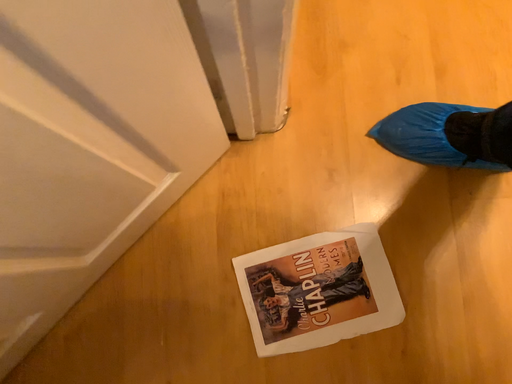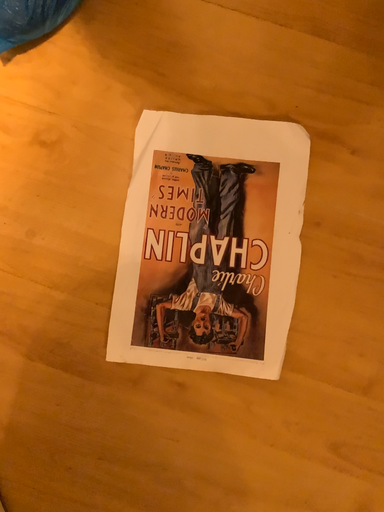
Question: Which way did the camera rotate in the video?

Choices:
 (A) rotated left
 (B) rotated right

Answer: (B)